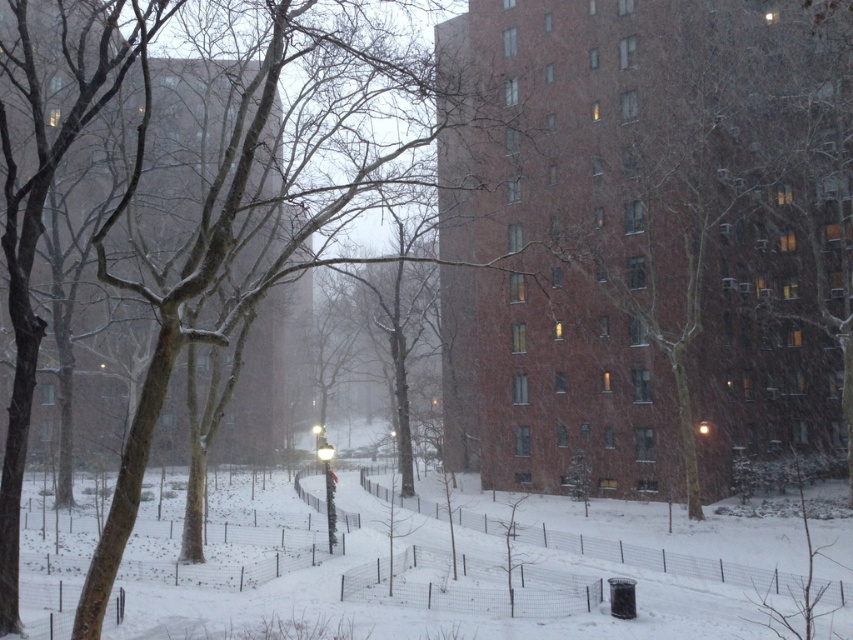
Question: Is bare branches at center below white fluffy snow at center?

Choices:
 (A) no
 (B) yes

Answer: (A)

Question: Does bare branches at center come behind white fluffy snow at center?

Choices:
 (A) yes
 (B) no

Answer: (B)

Question: Which point is farther from the camera taking this photo?

Choices:
 (A) (357, 16)
 (B) (695, 592)

Answer: (A)

Question: Is brown bark tree at center positioned at the back of white fluffy snow at center?

Choices:
 (A) no
 (B) yes

Answer: (A)

Question: Which point is farther from the camera taking this photo?

Choices:
 (A) (x=849, y=314)
 (B) (x=318, y=49)
 (C) (x=379, y=552)

Answer: (A)

Question: Which of the following is the closest to the observer?

Choices:
 (A) (21, 35)
 (B) (664, 140)
 (C) (527, 634)

Answer: (A)